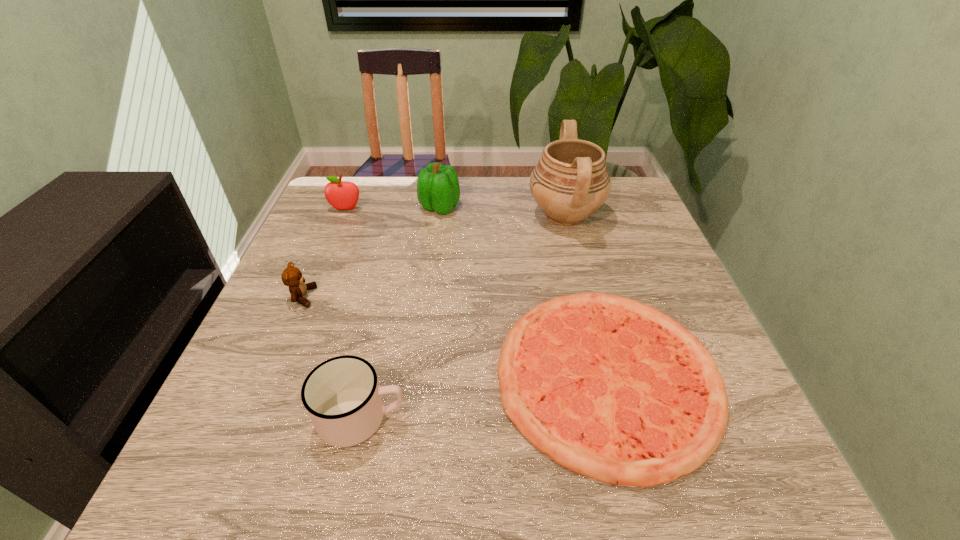
Find the location of a particular element. The height and width of the screenshot is (540, 960). teddy bear at the left edge is located at coordinates (291, 276).

The height and width of the screenshot is (540, 960). In order to click on urn at the right edge in this screenshot , I will do `click(570, 182)`.

What are the coordinates of `pizza present at the right edge` in the screenshot? It's located at (610, 388).

Locate an element on the screen. object situated at the far left corner is located at coordinates (342, 195).

The width and height of the screenshot is (960, 540). I want to click on object that is positioned at the far right corner, so click(570, 182).

Locate an element on the screen. object that is at the near right corner is located at coordinates pos(610,388).

This screenshot has height=540, width=960. In the image, there is a desktop. Find the location of `vacant space at the far edge`. vacant space at the far edge is located at coordinates (370, 222).

Image resolution: width=960 pixels, height=540 pixels. In the image, there is a desktop. Identify the location of vacant area at the near edge. (488, 462).

In the image, there is a desktop. Where is `free space at the left edge`? This screenshot has width=960, height=540. free space at the left edge is located at coordinates (350, 226).

In the image, there is a desktop. Where is `vacant space at the right edge`? The width and height of the screenshot is (960, 540). vacant space at the right edge is located at coordinates (677, 287).